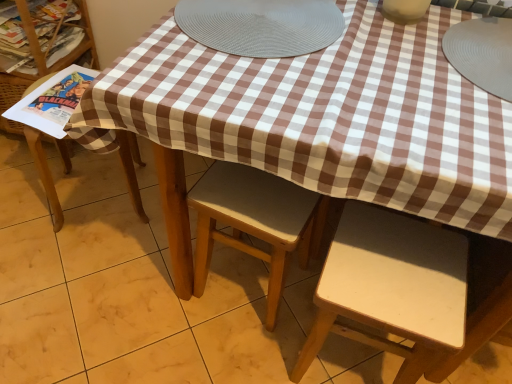
Where is `vacant space situated on the left part of white matte chair at lower right, placed as the 1th chair when sorted from right to left`? This screenshot has height=384, width=512. vacant space situated on the left part of white matte chair at lower right, placed as the 1th chair when sorted from right to left is located at coordinates (257, 347).